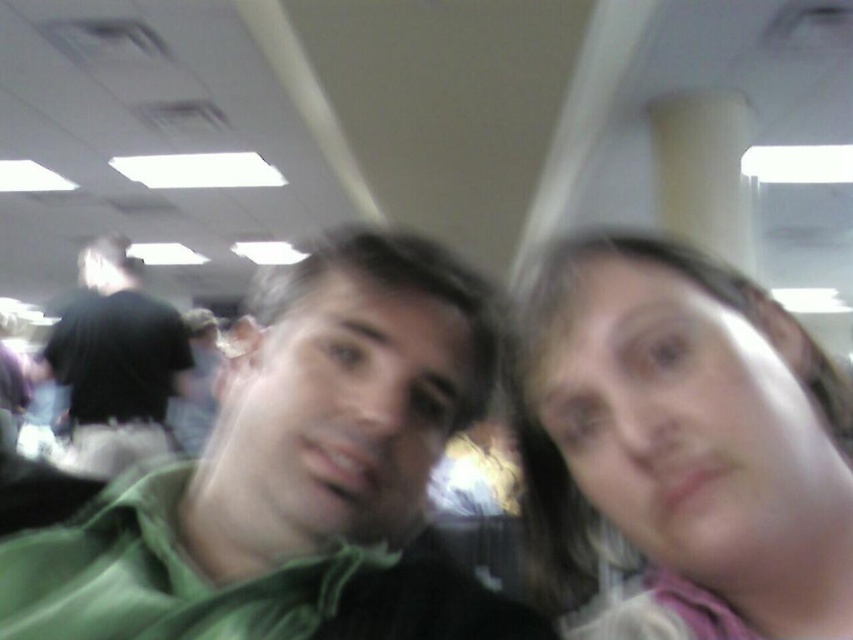
You are a photographer setting up a shoot in this room. You need to place a small light source between the blonde hair at upper right and the black matte shirt at left. Based on their positions, where should you place the light source relative to these two objects?

The blonde hair at upper right is positioned under the black matte shirt at left, so the light source should be placed between them by positioning it below the black matte shirt at left and above the blonde hair at upper right.

You are trying to determine the relative positions of the green matte shirt at center and the blonde hair at upper right in the image. Based on the scene description, which object is positioned higher up in the image?

The blonde hair at upper right is positioned higher up in the image than the green matte shirt at center.

You are organizing a clothing donation drive and need to determine if the green matte shirt at center and the black matte shirt at left can fit side by side on a shelf that is 1.2 meters wide. Based on their sizes, will they fit?

The green matte shirt at center has a width less than the black matte shirt at left. However, without knowing the exact width of either shirt, it is impossible to determine if their combined width is less than or equal to 1.2 meters. Additional measurements are needed.